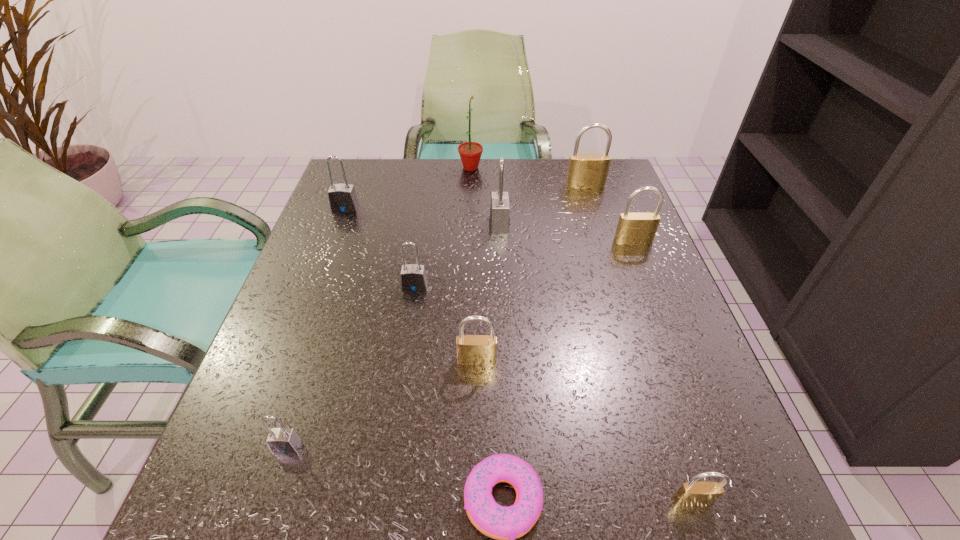
Find the location of a particular element. The height and width of the screenshot is (540, 960). free point between the fourth farthest padlock and the sunflower is located at coordinates (552, 204).

Locate an element on the screen. free space between the fourth farthest padlock and the smallest brass padlock is located at coordinates (663, 371).

Where is `vacant point located between the third farthest brass padlock and the seventh nearest object`? Image resolution: width=960 pixels, height=540 pixels. vacant point located between the third farthest brass padlock and the seventh nearest object is located at coordinates (488, 292).

The height and width of the screenshot is (540, 960). I want to click on vacant space that's between the nearest padlock and the tallest object, so click(x=582, y=334).

You are a GUI agent. You are given a task and a screenshot of the screen. Output one action in this format:
    pyautogui.click(x=<x>, y=<y>)
    Task: Click on the unoccupied area between the third nearest brass padlock and the third farthest gray padlock
    The image size is (960, 540).
    Given the screenshot: What is the action you would take?
    pyautogui.click(x=524, y=264)

Where is `object that stands as the second closest to the biggest gray padlock`? This screenshot has height=540, width=960. object that stands as the second closest to the biggest gray padlock is located at coordinates (585, 171).

Locate an element on the screen. This screenshot has width=960, height=540. the fourth closest object to the second nearest brass padlock is located at coordinates (692, 493).

Identify the location of padlock object that ranks as the second closest to the pink doughnut. (692, 493).

This screenshot has width=960, height=540. I want to click on the third closest padlock relative to the biggest brass padlock, so click(x=413, y=276).

Image resolution: width=960 pixels, height=540 pixels. I want to click on brass padlock that is the third closest one to the nearest padlock, so click(585, 171).